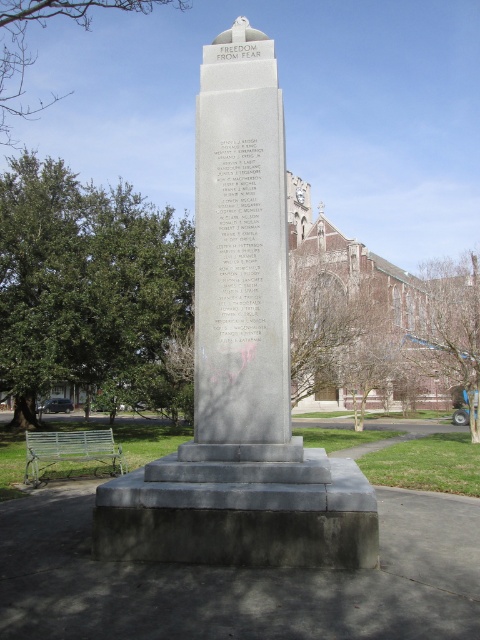
Is gray stone monument at center positioned in front of green painted wood park bench at lower left?

Yes, gray stone monument at center is in front of green painted wood park bench at lower left.

Is point (216, 356) closer to viewer compared to point (56, 442)?

Yes.

Locate an element on the screen. Image resolution: width=480 pixels, height=640 pixels. gray stone monument at center is located at coordinates (240, 365).

Based on the photo, can you confirm if gray stone monument at center is positioned to the left of gray polished stone monument at center?

In fact, gray stone monument at center is to the right of gray polished stone monument at center.

Between point (259, 84) and point (204, 204), which one is positioned behind?

The point (259, 84) is more distant.

Image resolution: width=480 pixels, height=640 pixels. What are the coordinates of `gray stone monument at center` in the screenshot? It's located at (240, 365).

Can you confirm if gray polished stone monument at center is positioned to the right of green painted wood park bench at lower left?

Indeed, gray polished stone monument at center is positioned on the right side of green painted wood park bench at lower left.

Can you confirm if gray polished stone monument at center is taller than green painted wood park bench at lower left?

Yes, gray polished stone monument at center is taller than green painted wood park bench at lower left.

The image size is (480, 640). What do you see at coordinates (240, 257) in the screenshot?
I see `gray polished stone monument at center` at bounding box center [240, 257].

Where is `gray polished stone monument at center`? This screenshot has height=640, width=480. gray polished stone monument at center is located at coordinates (240, 257).